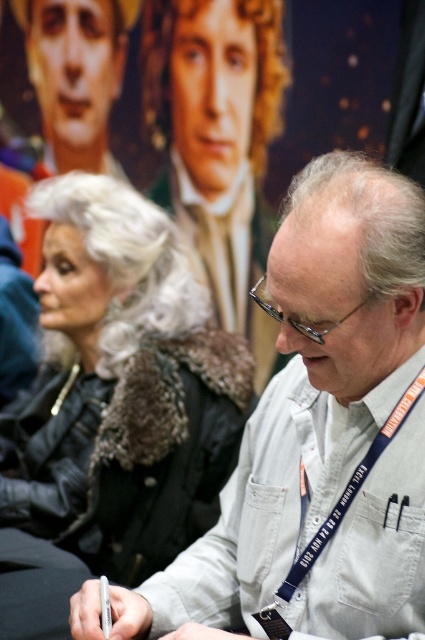
You are a photographer at the event and need to adjust your camera focus. Which object, the white cotton shirt at center or the smooth silver hair at upper center, is positioned lower in the frame?

The white cotton shirt at center is positioned lower in the frame than the smooth silver hair at upper center.

You are an event organizer at the Horror Hub booth. You need to arrange two shirts displayed at the center of the booth. The shirts are labeled as white cotton shirt at center and white textured shirt at center. Which shirt should you place on the left side to ensure it doesn not block the view of the other shirt?

The white cotton shirt at center is wider than the white textured shirt at center. To prevent blocking the view, place the narrower white textured shirt at center on the left so the wider white cotton shirt at center is on the right, ensuring both are visible.

You are a photographer at the event and need to capture a clear shot of both the white cotton shirt at center and the white textured shirt at center. Which shirt should you focus on first to ensure both are in focus?

You should focus on the white cotton shirt at center first because it is closer to the viewer, so adjusting the focus from there will help ensure the white textured shirt at center, which is further away, remains in focus as well.